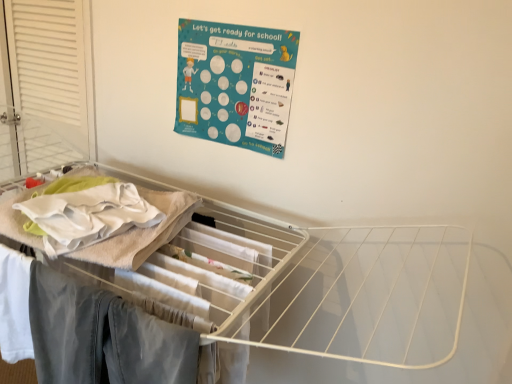
Question: Does white wire drying rack at upper center appear on the left side of white louvered screen door at left?

Choices:
 (A) yes
 (B) no

Answer: (B)

Question: Would you say white wire drying rack at upper center is a long distance from white louvered screen door at left?

Choices:
 (A) yes
 (B) no

Answer: (B)

Question: From a real-world perspective, is white wire drying rack at upper center physically below white louvered screen door at left?

Choices:
 (A) yes
 (B) no

Answer: (A)

Question: Can you confirm if white wire drying rack at upper center is positioned to the right of white louvered screen door at left?

Choices:
 (A) yes
 (B) no

Answer: (A)

Question: Is the position of white wire drying rack at upper center more distant than that of white louvered screen door at left?

Choices:
 (A) yes
 (B) no

Answer: (B)

Question: Is point (238, 61) closer or farther from the camera than point (87, 312)?

Choices:
 (A) farther
 (B) closer

Answer: (A)

Question: From their relative heights in the image, would you say teal paperboard poster at upper center is taller or shorter than denim pants at lower left?

Choices:
 (A) tall
 (B) short

Answer: (B)

Question: Looking at the image, does teal paperboard poster at upper center seem bigger or smaller compared to denim pants at lower left?

Choices:
 (A) big
 (B) small

Answer: (B)

Question: Based on their positions, is teal paperboard poster at upper center located to the left or right of denim pants at lower left?

Choices:
 (A) left
 (B) right

Answer: (B)

Question: Considering the positions of point (60, 349) and point (89, 34), is point (60, 349) closer or farther from the camera than point (89, 34)?

Choices:
 (A) closer
 (B) farther

Answer: (A)

Question: Considering the relative positions of denim pants at lower left and white louvered screen door at left in the image provided, is denim pants at lower left to the left or to the right of white louvered screen door at left?

Choices:
 (A) right
 (B) left

Answer: (A)

Question: Considering the positions of denim pants at lower left and white louvered screen door at left in the image, is denim pants at lower left taller or shorter than white louvered screen door at left?

Choices:
 (A) short
 (B) tall

Answer: (A)

Question: From a real-world perspective, relative to white louvered screen door at left, is denim pants at lower left vertically above or below?

Choices:
 (A) below
 (B) above

Answer: (A)

Question: Would you say denim pants at lower left is inside or outside white wire drying rack at upper center?

Choices:
 (A) outside
 (B) inside

Answer: (B)

Question: Considering the positions of point (81, 339) and point (189, 213), is point (81, 339) closer or farther from the camera than point (189, 213)?

Choices:
 (A) closer
 (B) farther

Answer: (A)